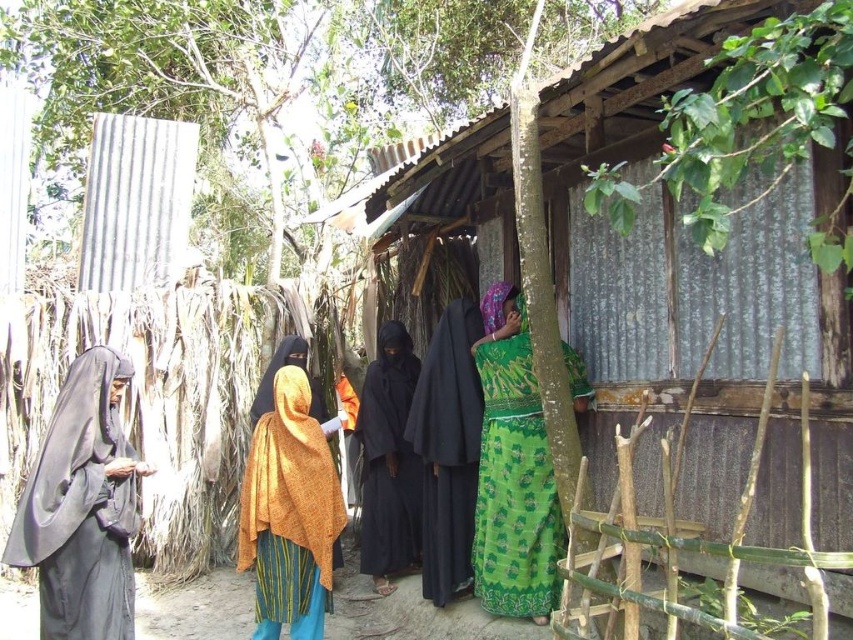
You are an observer standing in front of the rustic corrugated metal building. You notice two items at the center of the scene. Which item is positioned lower down between the orange textured shawl at center and the black matte dress at center?

The orange textured shawl at center is located below the black matte dress at center, so it is positioned lower down.

You are part of the group near the corrugated metal building and want to greet the person in the green printed dress at right. Which direction should you move relative to the black matte robe at center?

You should move to the right of the black matte robe at center to reach the green printed dress at right since the green printed dress at right is located to the right of the black matte robe at center.